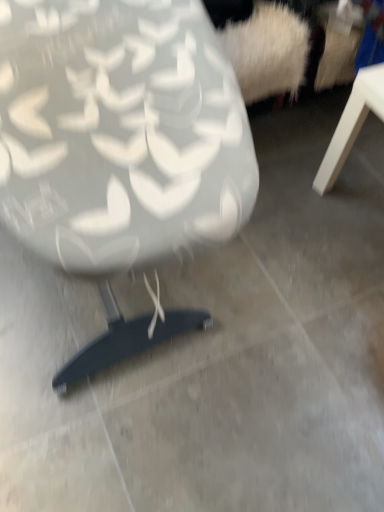
Question: Should I look upward or downward to see matte white chair at center?

Choices:
 (A) up
 (B) down

Answer: (A)

Question: Is matte white chair at center at the left side of white matte table at right?

Choices:
 (A) yes
 (B) no

Answer: (A)

Question: Does matte white chair at center appear on the right side of white matte table at right?

Choices:
 (A) no
 (B) yes

Answer: (A)

Question: Is matte white chair at center wider than white matte table at right?

Choices:
 (A) yes
 (B) no

Answer: (A)

Question: Is matte white chair at center positioned with its back to white matte table at right?

Choices:
 (A) yes
 (B) no

Answer: (B)

Question: Does matte white chair at center turn towards white matte table at right?

Choices:
 (A) no
 (B) yes

Answer: (A)

Question: Is the position of matte white chair at center more distant than that of white matte table at right?

Choices:
 (A) no
 (B) yes

Answer: (A)

Question: Is white matte table at right smaller than matte white chair at center?

Choices:
 (A) yes
 (B) no

Answer: (A)

Question: Is white matte table at right closer to the viewer compared to matte white chair at center?

Choices:
 (A) no
 (B) yes

Answer: (A)

Question: Is matte white chair at center located within white matte table at right?

Choices:
 (A) no
 (B) yes

Answer: (A)

Question: Is white matte table at right not inside matte white chair at center?

Choices:
 (A) yes
 (B) no

Answer: (A)

Question: Is white matte table at right placed right next to matte white chair at center?

Choices:
 (A) yes
 (B) no

Answer: (B)

Question: From the image's perspective, is white matte table at right beneath matte white chair at center?

Choices:
 (A) yes
 (B) no

Answer: (A)

Question: Considering the positions of matte white chair at center and white matte table at right in the image, is matte white chair at center taller or shorter than white matte table at right?

Choices:
 (A) tall
 (B) short

Answer: (A)